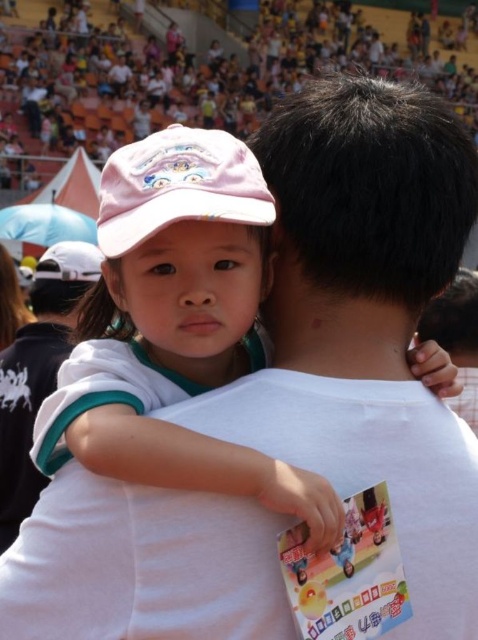
You are a photographer standing at the center of the arena. You want to take a photo that includes both the white cotton shirt at left and the white matte baseball cap at upper left. Given that your camera has a maximum zoom range of 5 meters, will you be able to capture both objects in the same frame without moving closer?

The white cotton shirt at left is 4.85 meters away from the white matte baseball cap at upper left. Since the camera can zoom up to 5 meters, the distance between them is within the maximum range. Therefore, the photographer can capture both objects in the same frame without moving closer.

You are a photographer taking a picture of the scene. You notice the pink fabric baseball cap at upper left and the white cotton shirt at left. Which object should you focus on first if you want to capture both in sharp focus?

The photographer should focus on the pink fabric baseball cap at upper left first because it is closer to the viewer than the white cotton shirt at left. By focusing on the closer object, the background object might still be in focus depending on the depth of field.